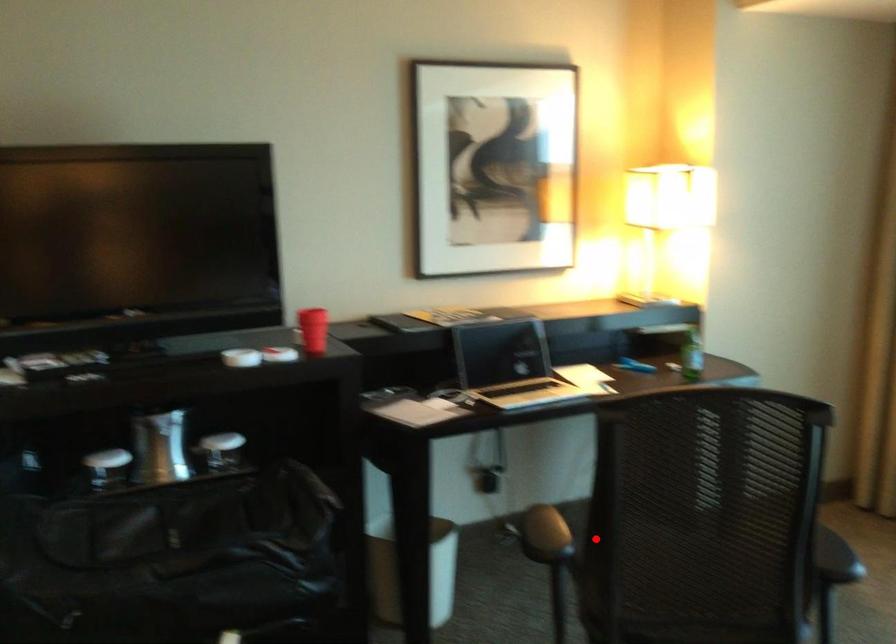
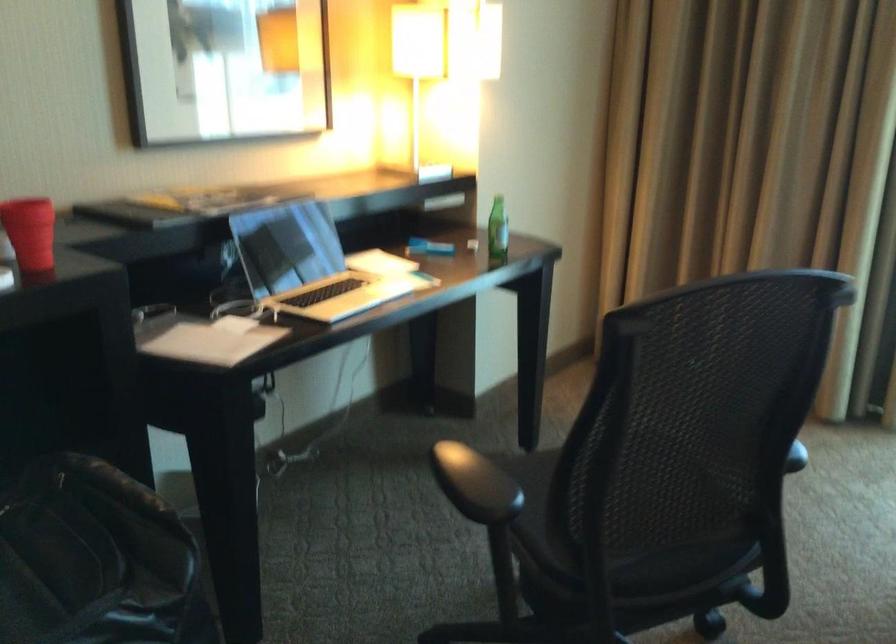
The point at the highlighted location is marked in the first image. Where is the corresponding point in the second image?

(558, 480)